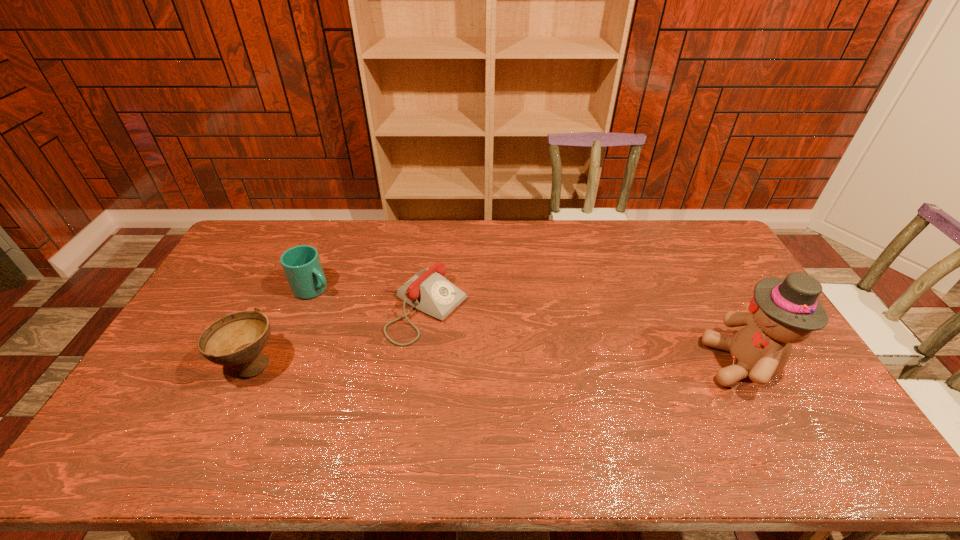
The height and width of the screenshot is (540, 960). Identify the location of free spot located on the dial of the telephone. (561, 387).

The image size is (960, 540). In order to click on free point located on the dial of the telephone in this screenshot , I will do `click(529, 369)`.

Image resolution: width=960 pixels, height=540 pixels. What are the coordinates of `vacant space located 0.250m on the dial of the telephone` in the screenshot? It's located at (529, 369).

Locate an element on the screen. The width and height of the screenshot is (960, 540). free space located on the handle side of the cup is located at coordinates (340, 301).

The width and height of the screenshot is (960, 540). Identify the location of vacant position located on the handle side of the cup. (396, 330).

Locate an element on the screen. The width and height of the screenshot is (960, 540). free space located 0.280m on the handle side of the cup is located at coordinates (394, 329).

This screenshot has width=960, height=540. In order to click on object that is positioned at the near edge in this screenshot , I will do `click(783, 311)`.

Find the location of a particular element. The height and width of the screenshot is (540, 960). object positioned at the right edge is located at coordinates (783, 311).

What are the coordinates of `object at the near right corner` in the screenshot? It's located at [x=783, y=311].

Locate an element on the screen. This screenshot has width=960, height=540. vacant point at the far edge is located at coordinates (443, 226).